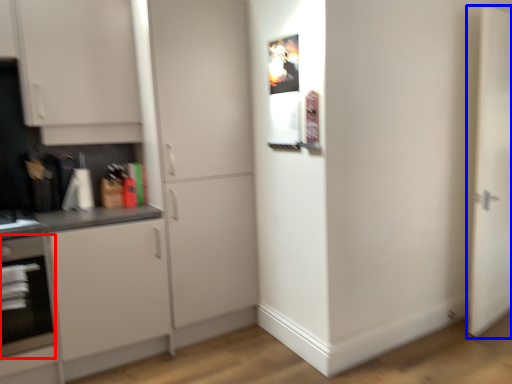
Question: Which point is further to the camera, oven (highlighted by a red box) or door (highlighted by a blue box)?

Choices:
 (A) oven
 (B) door

Answer: (B)